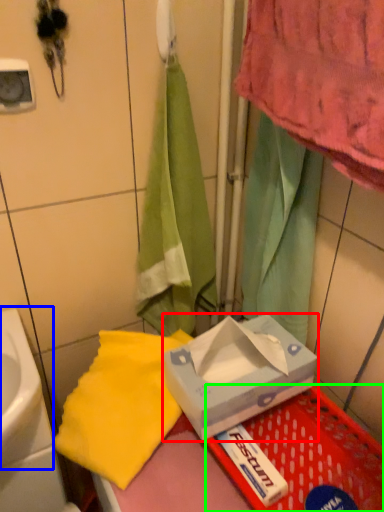
Question: Based on their relative distances, which object is farther from box (highlighted by a red box)? Choose from sink (highlighted by a blue box) and basket (highlighted by a green box).

Choices:
 (A) sink
 (B) basket

Answer: (A)